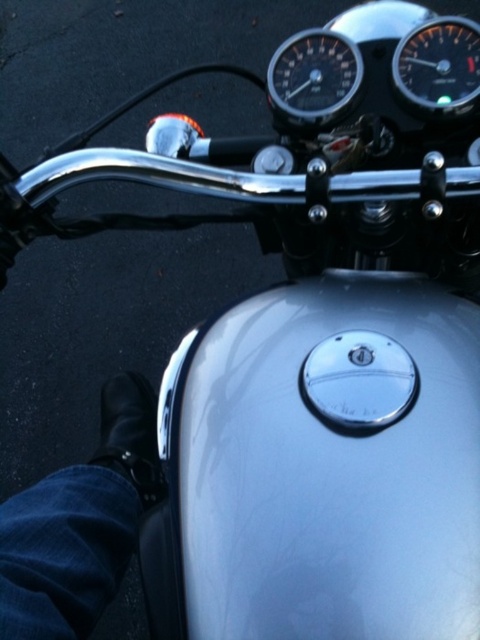
Question: Based on their relative distances, which object is farther from the black leather shoe at lower left?

Choices:
 (A) shiny black speedometer at upper center
 (B) black glossy speedometer at upper right

Answer: (B)

Question: Based on their relative distances, which object is nearer to the black leather shoe at lower left?

Choices:
 (A) shiny black speedometer at upper center
 (B) black glossy speedometer at upper right

Answer: (A)

Question: Can you confirm if shiny black speedometer at upper center is wider than black glossy speedometer at upper right?

Choices:
 (A) yes
 (B) no

Answer: (A)

Question: Can you confirm if black leather shoe at lower left is positioned above shiny black speedometer at upper center?

Choices:
 (A) yes
 (B) no

Answer: (B)

Question: Which object appears closest to the camera in this image?

Choices:
 (A) shiny black speedometer at upper center
 (B) black glossy speedometer at upper right
 (C) black leather shoe at lower left

Answer: (C)

Question: Is black leather shoe at lower left to the right of shiny black speedometer at upper center from the viewer's perspective?

Choices:
 (A) no
 (B) yes

Answer: (A)